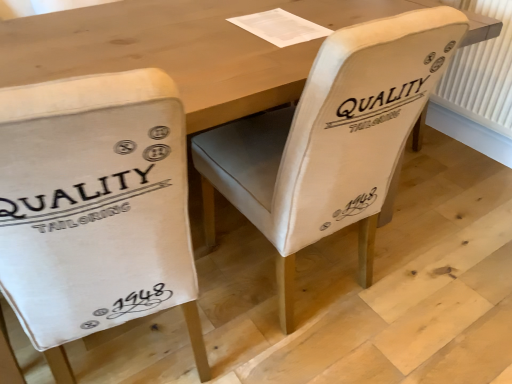
Locate an element on the screen. vacant space underneath white plastic radiator at right (from a real-world perspective) is located at coordinates (480, 152).